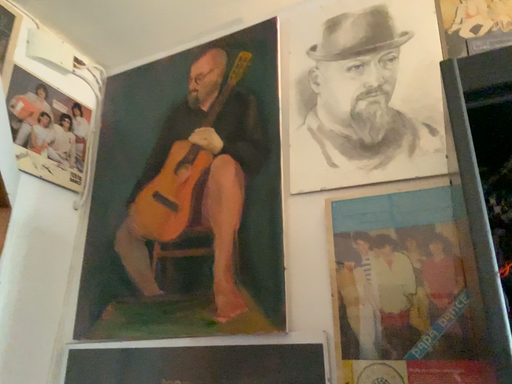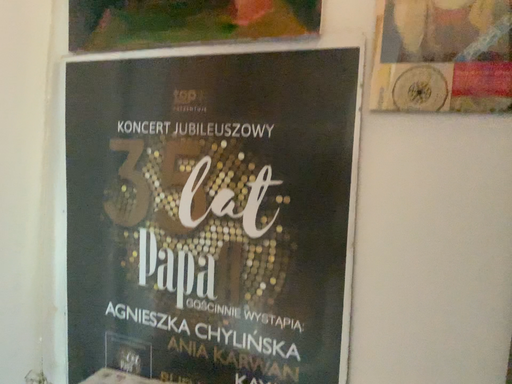
Question: How did the camera likely rotate when shooting the video?

Choices:
 (A) rotated upward
 (B) rotated downward

Answer: (B)